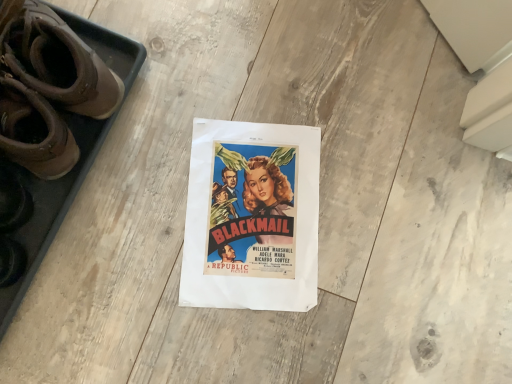
Question: Is brown leather boots at left oriented away from matte paper poster at center?

Choices:
 (A) yes
 (B) no

Answer: (A)

Question: Is brown leather boots at left outside of matte paper poster at center?

Choices:
 (A) yes
 (B) no

Answer: (A)

Question: Can you see brown leather boots at left touching matte paper poster at center?

Choices:
 (A) yes
 (B) no

Answer: (B)

Question: Is matte paper poster at center inside brown leather boots at left?

Choices:
 (A) no
 (B) yes

Answer: (A)

Question: Is brown leather boots at left shorter than matte paper poster at center?

Choices:
 (A) no
 (B) yes

Answer: (A)

Question: From the image's perspective, is brown leather boots at left above matte paper poster at center?

Choices:
 (A) yes
 (B) no

Answer: (A)

Question: From a real-world perspective, is matte paper poster at center physically above brown leather boots at left?

Choices:
 (A) no
 (B) yes

Answer: (A)

Question: From the image's perspective, does matte paper poster at center appear higher than brown leather boots at left?

Choices:
 (A) yes
 (B) no

Answer: (B)

Question: Can you confirm if matte paper poster at center is positioned to the right of brown leather boots at left?

Choices:
 (A) no
 (B) yes

Answer: (B)

Question: Would you say matte paper poster at center is outside brown leather boots at left?

Choices:
 (A) no
 (B) yes

Answer: (B)

Question: Does matte paper poster at center lie in front of brown leather boots at left?

Choices:
 (A) yes
 (B) no

Answer: (B)

Question: Can you confirm if matte paper poster at center is taller than brown leather boots at left?

Choices:
 (A) no
 (B) yes

Answer: (A)

Question: Is point (49, 18) closer or farther from the camera than point (249, 147)?

Choices:
 (A) farther
 (B) closer

Answer: (B)